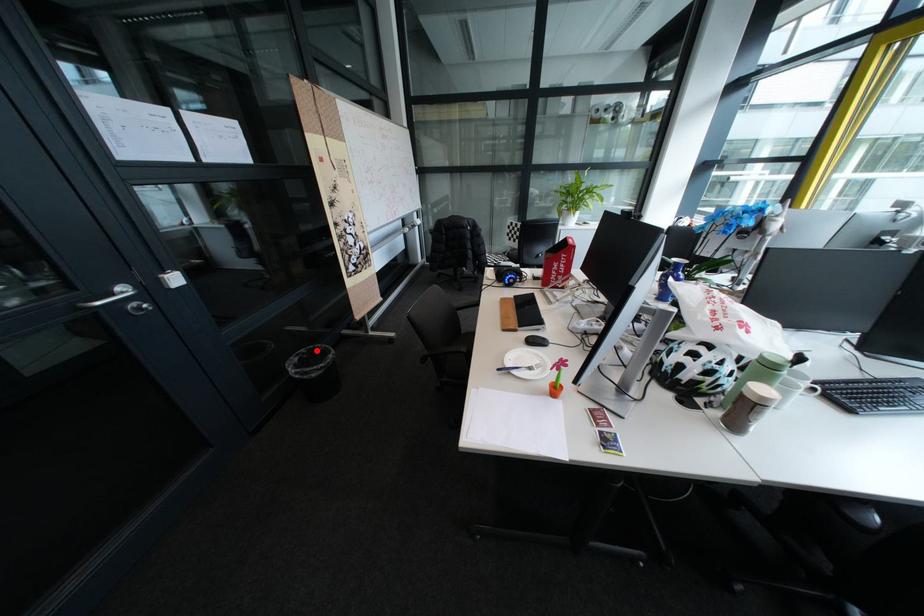
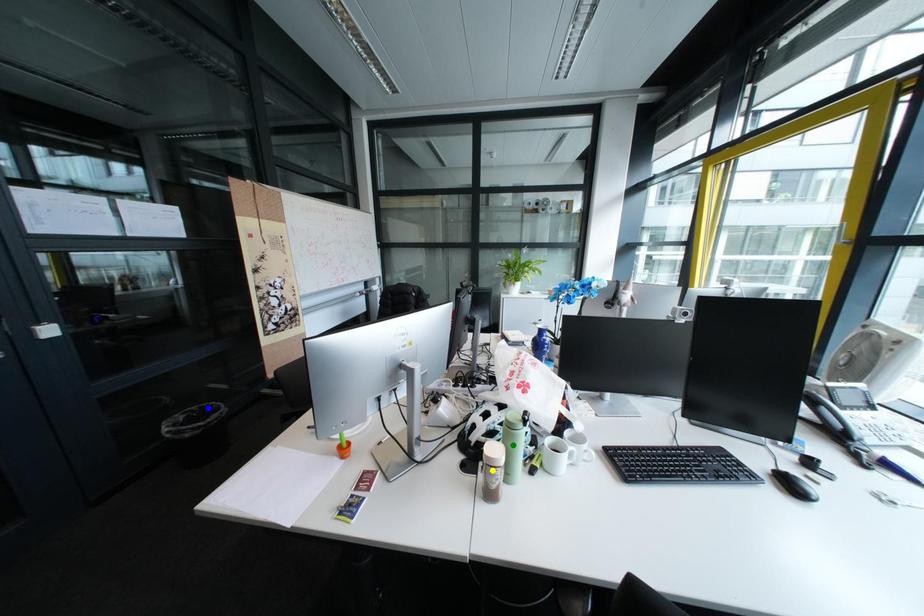
Question: I am providing you with two images of the same scene from different viewpoints. A red point is marked on the first image. You are given multiple points on the second image. Which mark in image 2 goes with the point in image 1?

Choices:
 (A) green point
 (B) blue point
 (C) yellow point

Answer: (B)